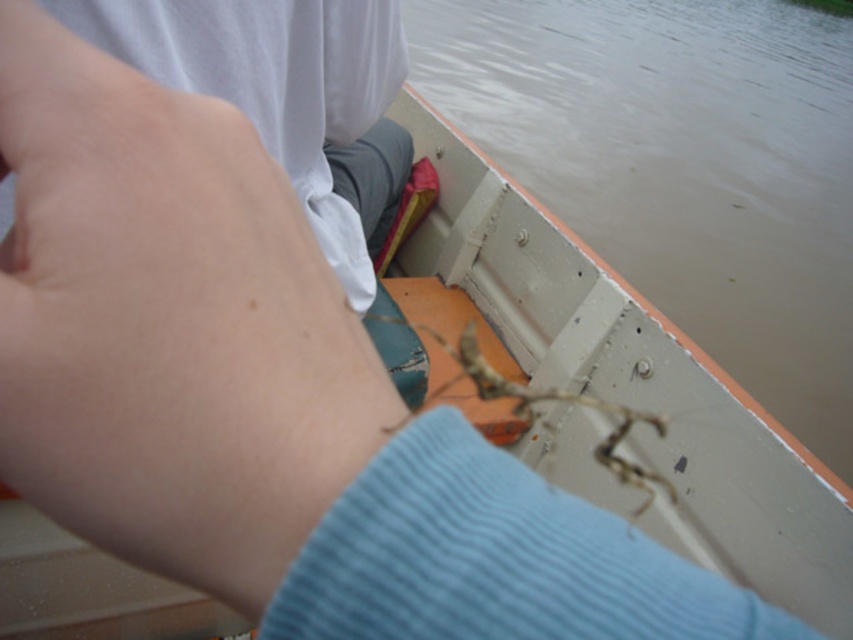
Is skinny flesh at center further to camera compared to muddy water at upper right?

No.

Who is lower down, skinny flesh at center or muddy water at upper right?

skinny flesh at center

This screenshot has height=640, width=853. What do you see at coordinates (167, 324) in the screenshot? I see `skinny flesh at center` at bounding box center [167, 324].

Identify the location of skinny flesh at center. (167, 324).

Is muddy water at upper right thinner than brown textured spider at center?

In fact, muddy water at upper right might be wider than brown textured spider at center.

Which is more to the right, muddy water at upper right or brown textured spider at center?

muddy water at upper right is more to the right.

The image size is (853, 640). Describe the element at coordinates (682, 164) in the screenshot. I see `muddy water at upper right` at that location.

The image size is (853, 640). I want to click on muddy water at upper right, so click(682, 164).

Does point (25, 486) come in front of point (466, 413)?

Yes, it is.

Can you confirm if skinny flesh at center is positioned below brown textured spider at center?

No, skinny flesh at center is not below brown textured spider at center.

In the scene shown: Who is more forward, (186, 100) or (526, 387)?

Point (186, 100) is more forward.

Find the location of a particular element. skinny flesh at center is located at coordinates (167, 324).